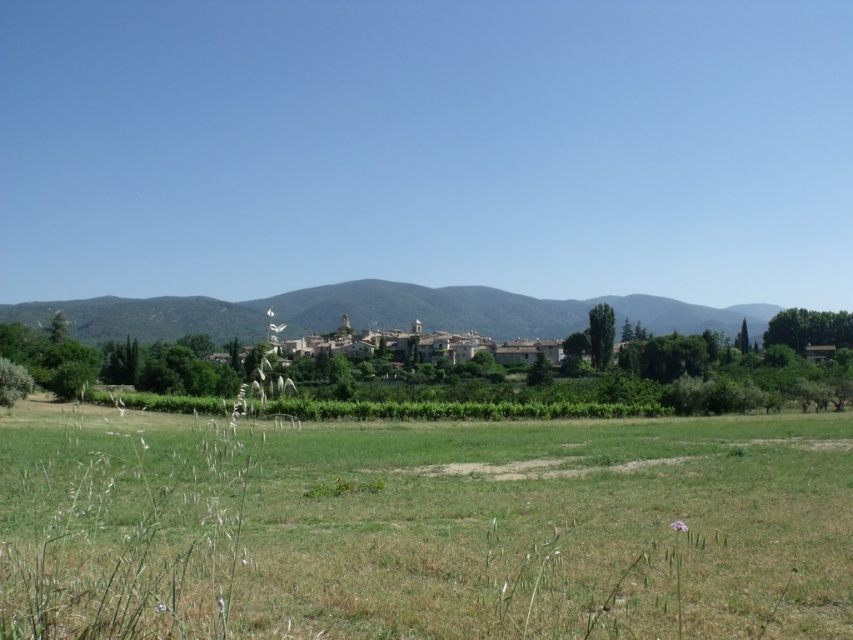
You are a gardener planning to mow the green grassy field at lower center and the green grassy hill at center. Which area requires a taller mower blade setting to accommodate the grass height?

The green grassy hill at center requires a taller mower blade setting because it is taller than the green grassy field at lower center.

You are a hiker standing at the edge of the green grassy field at lower center and want to reach the green grassy hill at center. Which direction should you move to get closer to the hill?

The green grassy field at lower center is in front of the green grassy hill at center, so you should move forward towards the hill to get closer.